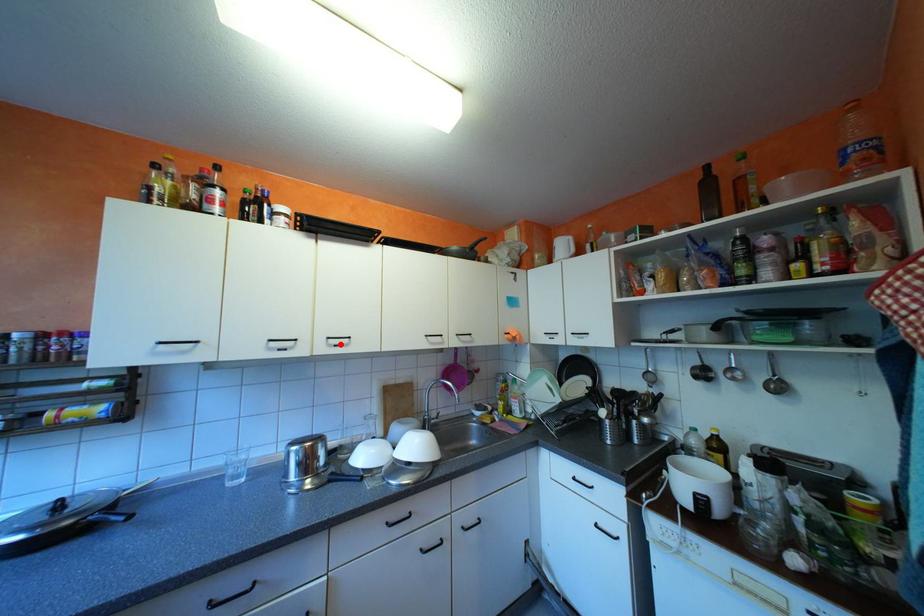
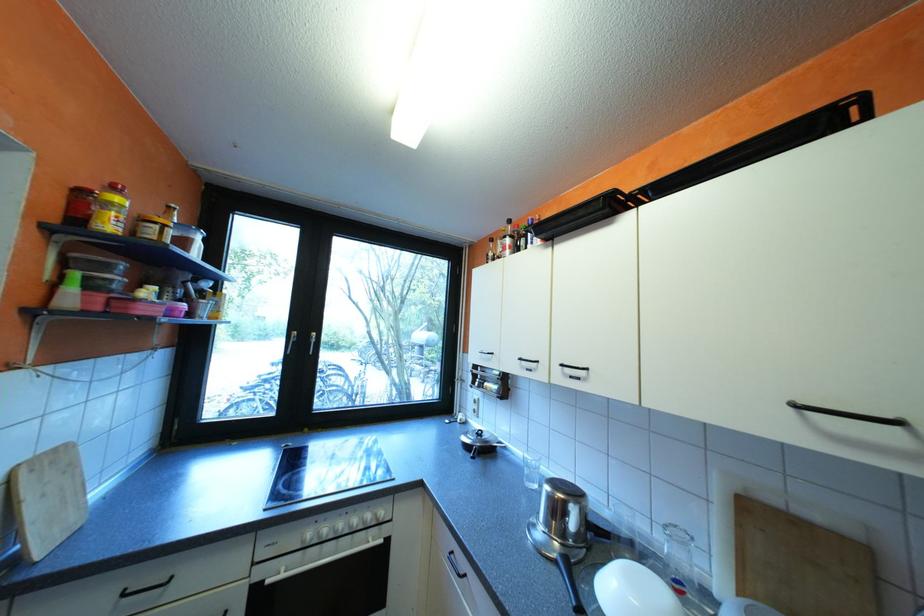
The point at the highlighted location is marked in the first image. Where is the corresponding point in the second image?

(576, 373)